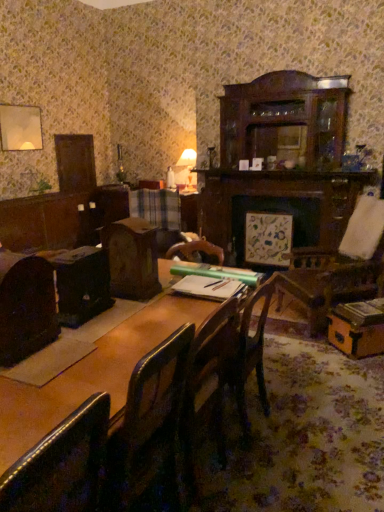
Locate an element on the screen. The image size is (384, 512). vacant area to the right of dark brown leather chair at left, arranged as the 1th chair when viewed from the back is located at coordinates (81, 347).